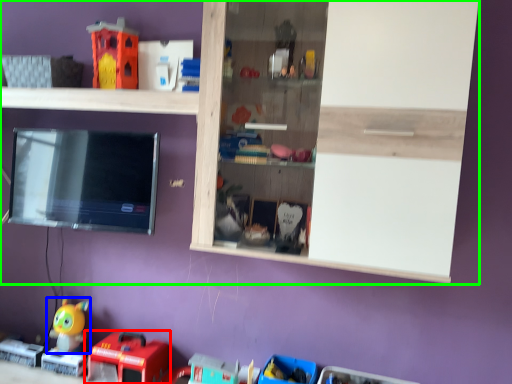
Question: Estimate the real-world distances between objects in this image. Which object is closer to toy (highlighted by a red box), toy (highlighted by a blue box) or shelf (highlighted by a green box)?

Choices:
 (A) toy
 (B) shelf

Answer: (A)